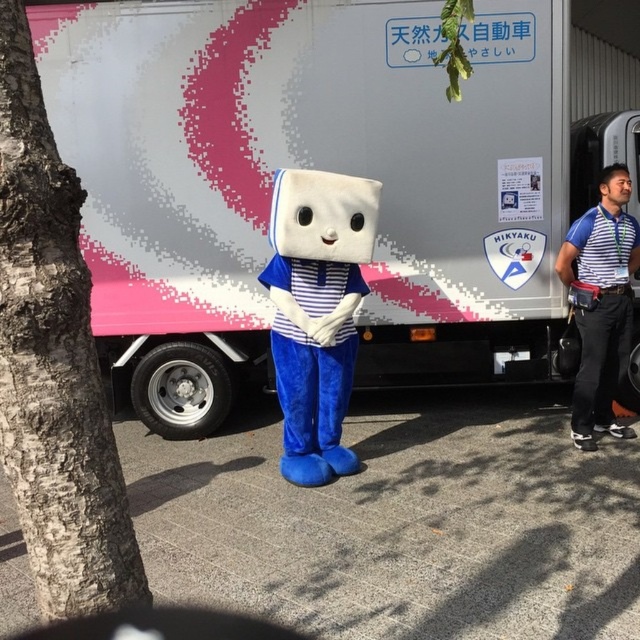
You are a photographer standing at the center of the scene. You want to take a photo of the white plush mascot at center and the blue striped shirt at right such that both are in frame. Given that your camera has a maximum horizontal field of view of 1.8 meters, will you be able to capture both objects in a single shot?

The white plush mascot at center is 2.01 meters away from the blue striped shirt at right, which exceeds the camera field of view of 1.8 meters. Therefore, you cannot capture both objects in a single shot.

You are a photographer trying to capture both the white matte truck at center and the blue striped shirt at right in a single shot. Based on their positions, which object should you focus on first to ensure both are in frame?

The white matte truck at center is positioned over the blue striped shirt at right, so focusing on the truck first will help ensure both are in frame as the truck is above the shirt.

You are standing at the origin point in the image. There is a point marked at coordinates [321,168]. What object is located at that point?

The point at coordinates [321,168] corresponds to the white matte truck at center.